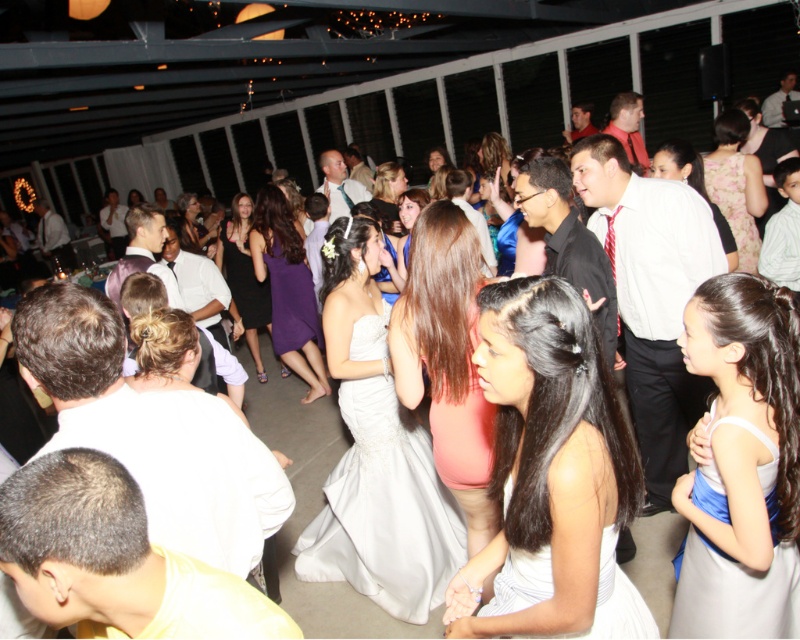
Question: Can you confirm if white satin dress at lower center is bigger than pink satin dress at center?

Choices:
 (A) yes
 (B) no

Answer: (B)

Question: Among these objects, which one is nearest to the camera?

Choices:
 (A) white satin dress at lower center
 (B) black satin dress at center

Answer: (A)

Question: Among these objects, which one is farthest from the camera?

Choices:
 (A) black satin dress at center
 (B) light blue satin dress at lower right

Answer: (A)

Question: Which of the following is the closest to the observer?

Choices:
 (A) satin white dress at center
 (B) white satin dress at lower center
 (C) floral-patterned fabric dress at upper right

Answer: (B)

Question: Is purple satin dress at center to the left of black satin dress at center from the viewer's perspective?

Choices:
 (A) yes
 (B) no

Answer: (B)

Question: Does white satin dress at lower center have a smaller size compared to floral-patterned fabric dress at upper right?

Choices:
 (A) no
 (B) yes

Answer: (B)